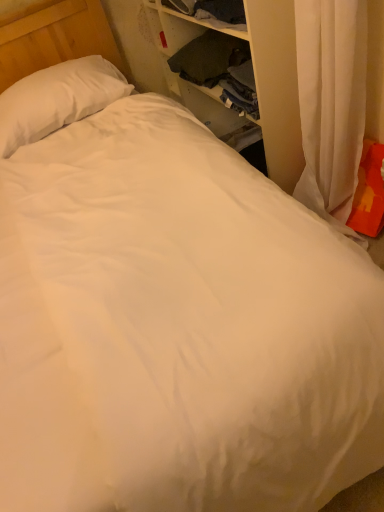
Question: Is wooden dresser at upper right not within white soft pillow at upper left, which is the second pillow in right-to-left order?

Choices:
 (A) no
 (B) yes

Answer: (B)

Question: Is wooden dresser at upper right oriented towards white soft pillow at upper left, which is counted as the 1th pillow, starting from the top?

Choices:
 (A) yes
 (B) no

Answer: (A)

Question: Considering the relative positions of wooden dresser at upper right and white soft pillow at upper left, which is the second pillow in right-to-left order, in the image provided, is wooden dresser at upper right in front of white soft pillow at upper left, which is the second pillow in right-to-left order,?

Choices:
 (A) no
 (B) yes

Answer: (B)

Question: Does wooden dresser at upper right have a smaller size compared to white soft pillow at upper left, acting as the 1th pillow starting from the back?

Choices:
 (A) no
 (B) yes

Answer: (A)

Question: From a real-world perspective, is wooden dresser at upper right beneath white soft pillow at upper left, which is the second pillow in right-to-left order?

Choices:
 (A) no
 (B) yes

Answer: (B)

Question: Is white soft pillow at upper left, the 2th pillow positioned from the bottom, at the back of wooden dresser at upper right?

Choices:
 (A) yes
 (B) no

Answer: (B)

Question: Could you tell me if white soft pillow at upper left, acting as the 1th pillow starting from the back, is facing orange fabric pillow at right, the first pillow viewed from the right?

Choices:
 (A) yes
 (B) no

Answer: (B)

Question: Considering the relative sizes of white soft pillow at upper left, which is the second pillow in right-to-left order, and orange fabric pillow at right, marked as the 2th pillow in a back-to-front arrangement, in the image provided, is white soft pillow at upper left, which is the second pillow in right-to-left order, smaller than orange fabric pillow at right, marked as the 2th pillow in a back-to-front arrangement,?

Choices:
 (A) no
 (B) yes

Answer: (A)

Question: Can you confirm if white soft pillow at upper left, the first pillow in the left-to-right sequence, is thinner than orange fabric pillow at right, the second pillow when ordered from top to bottom?

Choices:
 (A) no
 (B) yes

Answer: (A)

Question: From the image's perspective, is white soft pillow at upper left, which is the second pillow in right-to-left order, on top of orange fabric pillow at right, the first pillow viewed from the right?

Choices:
 (A) no
 (B) yes

Answer: (B)

Question: From a real-world perspective, is white soft pillow at upper left, arranged as the 2th pillow when viewed from the front, positioned under orange fabric pillow at right, the second pillow when ordered from top to bottom, based on gravity?

Choices:
 (A) no
 (B) yes

Answer: (A)

Question: Is white soft pillow at upper left, which is counted as the 1th pillow, starting from the top, looking in the opposite direction of orange fabric pillow at right, the first pillow viewed from the right?

Choices:
 (A) yes
 (B) no

Answer: (B)

Question: From a real-world perspective, does orange fabric pillow at right, marked as the 2th pillow in a back-to-front arrangement, stand above wooden dresser at upper right?

Choices:
 (A) yes
 (B) no

Answer: (B)